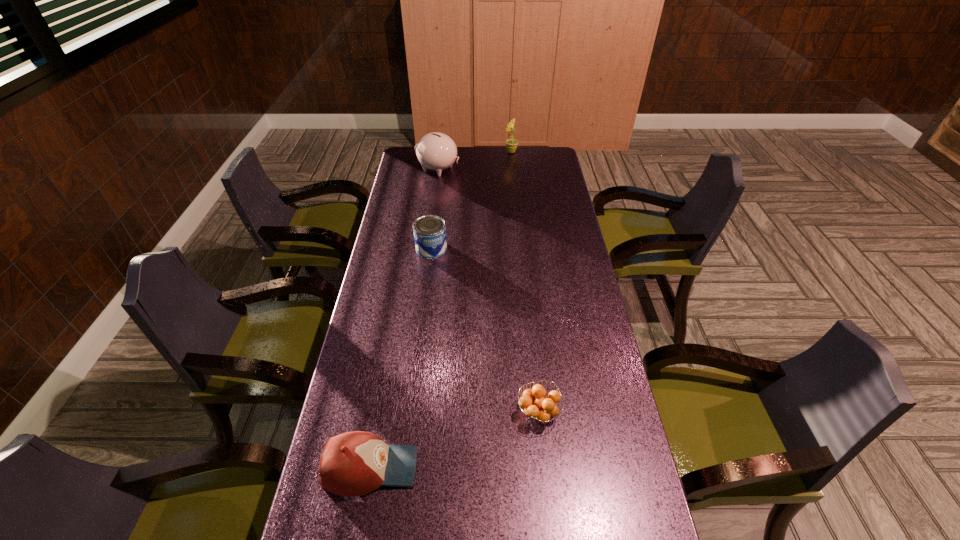
The height and width of the screenshot is (540, 960). What are the coordinates of `sunflower` in the screenshot? It's located at (511, 144).

You are a GUI agent. You are given a task and a screenshot of the screen. Output one action in this format:
    pyautogui.click(x=<x>, y=<y>)
    Task: Click on the fourth nearest object
    This screenshot has height=540, width=960.
    Given the screenshot: What is the action you would take?
    pyautogui.click(x=436, y=151)

Where is `the third farthest object`? the third farthest object is located at coordinates (429, 230).

Find the location of a particular element. the nearest object is located at coordinates (356, 463).

The width and height of the screenshot is (960, 540). I want to click on the shortest object, so click(x=540, y=408).

Identify the location of the second nearest object. The height and width of the screenshot is (540, 960). (540, 408).

Identify the location of vacant space situated on the face of the sunflower. This screenshot has height=540, width=960. (468, 152).

Find the location of `vacant space situated 0.220m on the face of the sunflower`. vacant space situated 0.220m on the face of the sunflower is located at coordinates (460, 152).

Locate an element on the screen. The image size is (960, 540). free space located 0.170m on the face of the sunflower is located at coordinates [470, 152].

Identify the location of vacant space located on the front of the piggy bank. (431, 220).